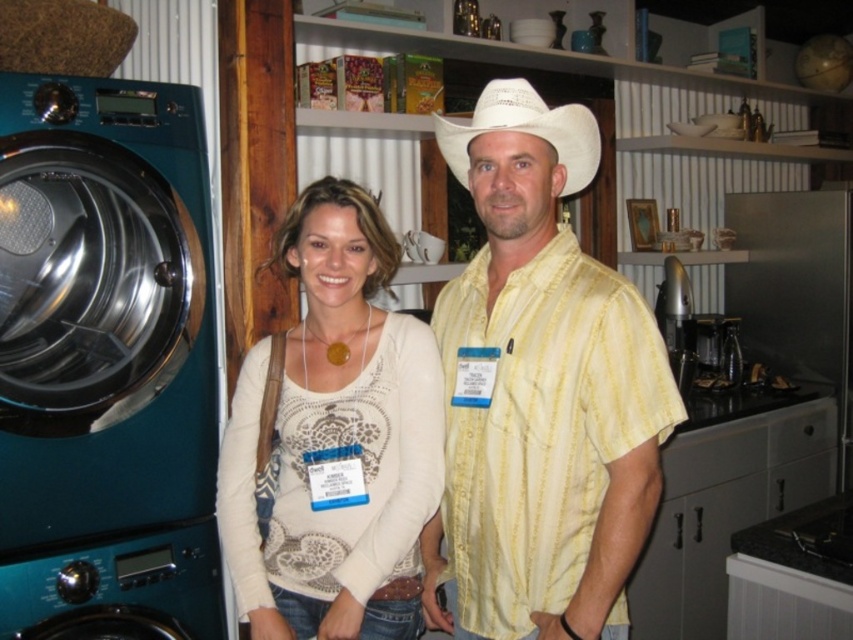
Question: Does yellow striped shirt at center appear on the left side of white woven cowboy hat at center?

Choices:
 (A) yes
 (B) no

Answer: (B)

Question: Which point is farther from the camera taking this photo?

Choices:
 (A) (485, 131)
 (B) (318, 525)
 (C) (113, 412)
 (D) (531, 99)

Answer: (C)

Question: Does yellow striped shirt at center have a greater width compared to white lace sweater at center?

Choices:
 (A) yes
 (B) no

Answer: (B)

Question: Which object is positioned farthest from the white woven cowboy hat at center?

Choices:
 (A) yellow striped shirt at center
 (B) teal glossy washing machine at left
 (C) white lace sweater at center

Answer: (B)

Question: Does teal glossy washing machine at left have a larger size compared to white lace sweater at center?

Choices:
 (A) yes
 (B) no

Answer: (B)

Question: Which point is farther to the camera?

Choices:
 (A) (508, 88)
 (B) (375, 204)
 (C) (155, 220)

Answer: (C)